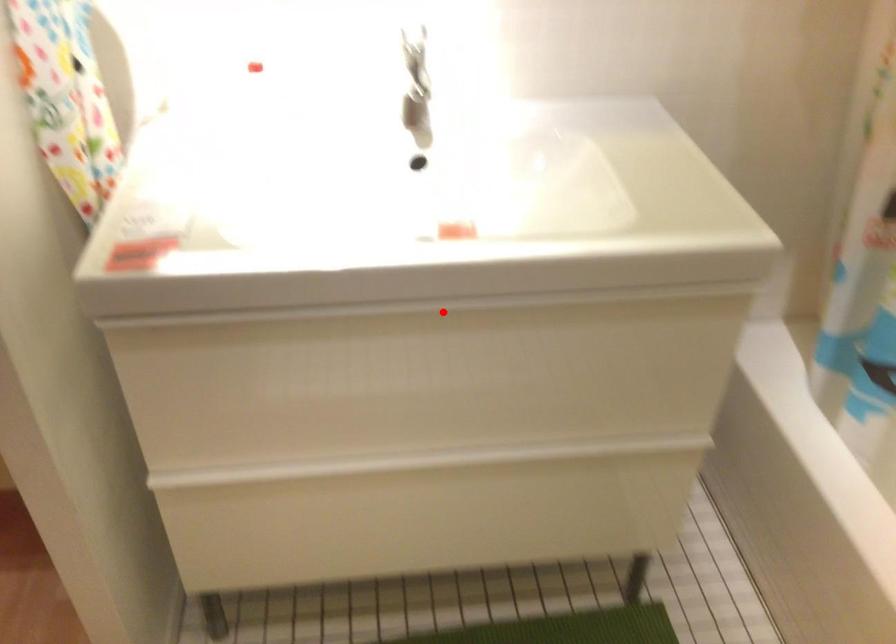
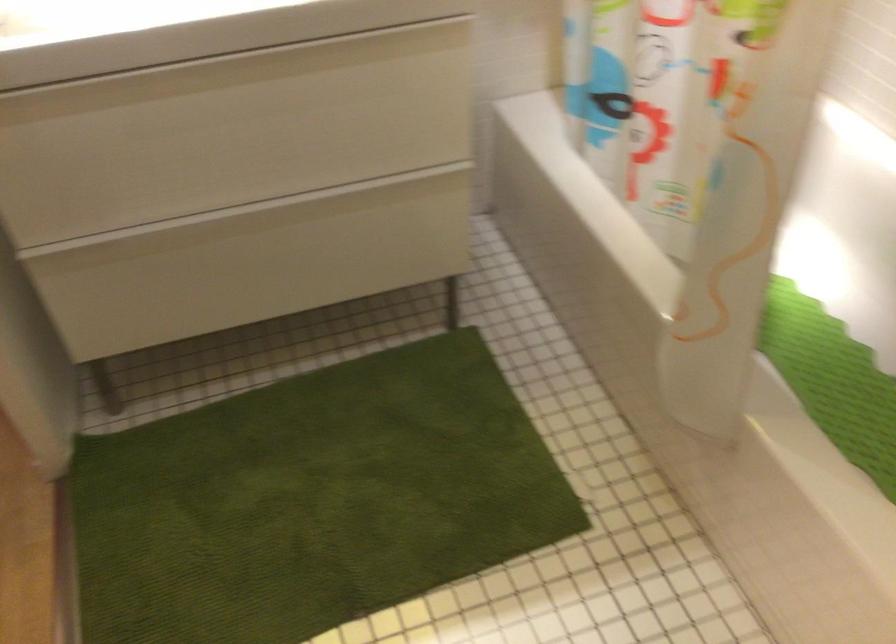
Question: I am providing you with two images of the same scene from different viewpoints. In image1, a red point is highlighted. Considering the same 3D point in image2, which of the following is correct?

Choices:
 (A) It is closer
 (B) It is farther

Answer: (B)